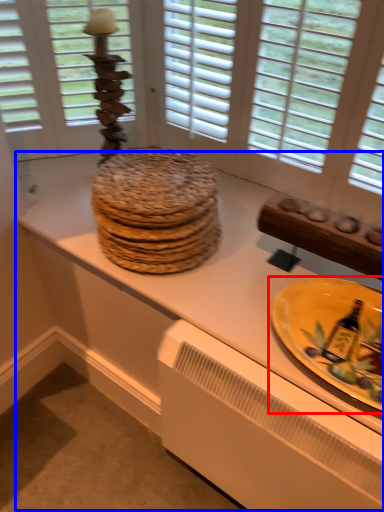
Question: Which of the following is the farthest to the observer, plate (highlighted by a red box) or counter top (highlighted by a blue box)?

Choices:
 (A) plate
 (B) counter top

Answer: (B)